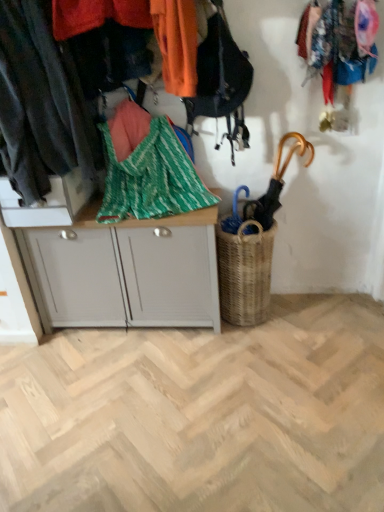
Question: Does green woven blanket at center lie in front of white matte cabinet at center?

Choices:
 (A) yes
 (B) no

Answer: (A)

Question: Does green woven blanket at center have a greater height compared to white matte cabinet at center?

Choices:
 (A) yes
 (B) no

Answer: (B)

Question: From a real-world perspective, does green woven blanket at center sit lower than white matte cabinet at center?

Choices:
 (A) no
 (B) yes

Answer: (A)

Question: Considering the relative positions of green woven blanket at center and white matte cabinet at center in the image provided, is green woven blanket at center to the left of white matte cabinet at center from the viewer's perspective?

Choices:
 (A) yes
 (B) no

Answer: (B)

Question: Does green woven blanket at center have a larger size compared to white matte cabinet at center?

Choices:
 (A) yes
 (B) no

Answer: (B)

Question: Is green woven blanket at center shorter than white matte cabinet at center?

Choices:
 (A) yes
 (B) no

Answer: (A)

Question: Does woven brown basket at center-right have a greater width compared to wooden umbrella at right?

Choices:
 (A) yes
 (B) no

Answer: (A)

Question: Does woven brown basket at center-right have a lesser height compared to wooden umbrella at right?

Choices:
 (A) yes
 (B) no

Answer: (B)

Question: From the image's perspective, is woven brown basket at center-right over wooden umbrella at right?

Choices:
 (A) no
 (B) yes

Answer: (A)

Question: From a real-world perspective, does woven brown basket at center-right stand above wooden umbrella at right?

Choices:
 (A) no
 (B) yes

Answer: (A)

Question: Can you confirm if woven brown basket at center-right is taller than wooden umbrella at right?

Choices:
 (A) no
 (B) yes

Answer: (B)

Question: From the image's perspective, is woven brown basket at center-right under wooden umbrella at right?

Choices:
 (A) yes
 (B) no

Answer: (A)

Question: Is dark gray fabric at left, the second clothing in the right-to-left sequence, with woven brown basket at center-right?

Choices:
 (A) no
 (B) yes

Answer: (A)